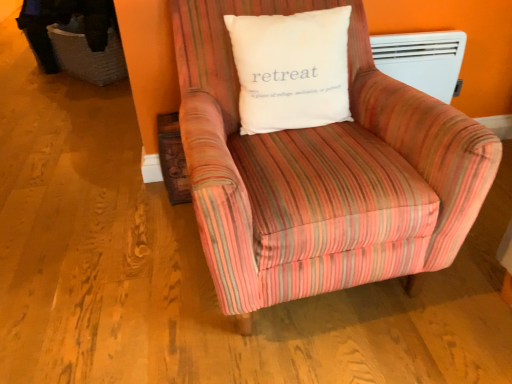
Question: Can you see white cotton pillow at center touching white plastic heater at upper right?

Choices:
 (A) no
 (B) yes

Answer: (A)

Question: Is white cotton pillow at center taller than white plastic heater at upper right?

Choices:
 (A) no
 (B) yes

Answer: (B)

Question: Does white cotton pillow at center lie in front of white plastic heater at upper right?

Choices:
 (A) yes
 (B) no

Answer: (A)

Question: Can white plastic heater at upper right be found inside white cotton pillow at center?

Choices:
 (A) yes
 (B) no

Answer: (B)

Question: Can you confirm if white cotton pillow at center is smaller than white plastic heater at upper right?

Choices:
 (A) yes
 (B) no

Answer: (B)

Question: Is white cotton pillow at center far away from white plastic heater at upper right?

Choices:
 (A) yes
 (B) no

Answer: (B)

Question: From a real-world perspective, is white cotton pillow at center physically above striped fabric armchair at center?

Choices:
 (A) no
 (B) yes

Answer: (B)

Question: Is white cotton pillow at center with striped fabric armchair at center?

Choices:
 (A) yes
 (B) no

Answer: (B)

Question: Is there a large distance between white cotton pillow at center and striped fabric armchair at center?

Choices:
 (A) yes
 (B) no

Answer: (B)

Question: Considering the relative positions of white cotton pillow at center and striped fabric armchair at center in the image provided, is white cotton pillow at center to the right of striped fabric armchair at center from the viewer's perspective?

Choices:
 (A) no
 (B) yes

Answer: (A)

Question: Is white cotton pillow at center closer to the viewer compared to striped fabric armchair at center?

Choices:
 (A) yes
 (B) no

Answer: (B)

Question: Is white cotton pillow at center shorter than striped fabric armchair at center?

Choices:
 (A) yes
 (B) no

Answer: (A)

Question: Is white cotton pillow at center at the back of striped fabric armchair at center?

Choices:
 (A) no
 (B) yes

Answer: (B)